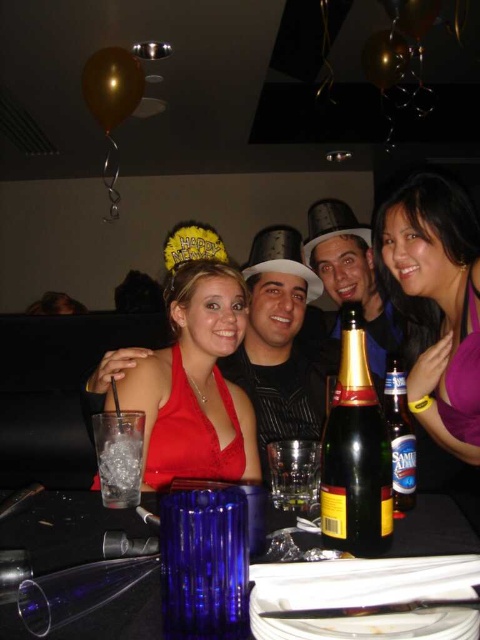
You are at the party and want to move from the champagne bottle to the beer bottle. The champagne bottle is located at point (352, 520), and the beer bottle is at point (142, 445). Which direction should you move to reach the beer bottle from the champagne bottle?

To reach the beer bottle at point (142, 445) from the champagne bottle at point (352, 520), you should move downward and to the left since point (352, 520) is in front of point (142, 445).

You are a bartender who needs to reach both the green glass bottle at center and the clear glass at lower left. Which one should you grab first to serve a drink quickly?

The green glass bottle at center should be grabbed first because it is closer to the viewer than the clear glass at lower left, making it easier to reach quickly.